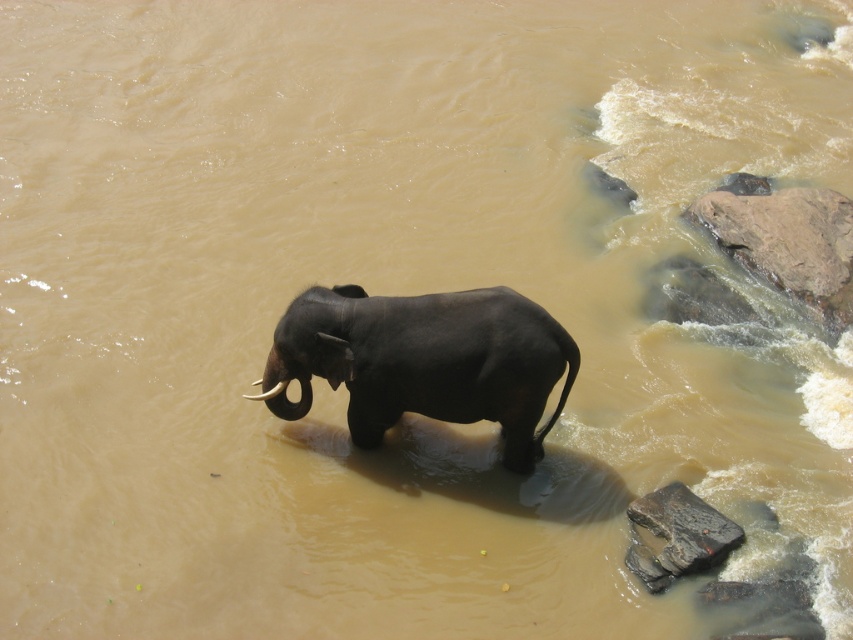
You are a wildlife photographer aiming to capture the white ivory tusk at center and the dark gray stone at lower right in the same frame. Based on their sizes, which object would require you to zoom out more to include both in the shot?

The dark gray stone at lower right is wider than the white ivory tusk at center, so you would need to zoom out more to include both the dark gray stone at lower right and the white ivory tusk at center in the same frame.

You are a geologist examining the scene. You need to determine which object is larger between the dark gray stone at lower right and the white ivory tusk at center. Which one is bigger?

The dark gray stone at lower right is bigger than the white ivory tusk at center according to the description.

You are a wildlife photographer observing the scene. You notice the shiny black elephant at center and the white ivory tusk at upper center. Which object is closer to the photographer?

The white ivory tusk at upper center is closer to the photographer because it is positioned under the shiny black elephant at center, which is above it.